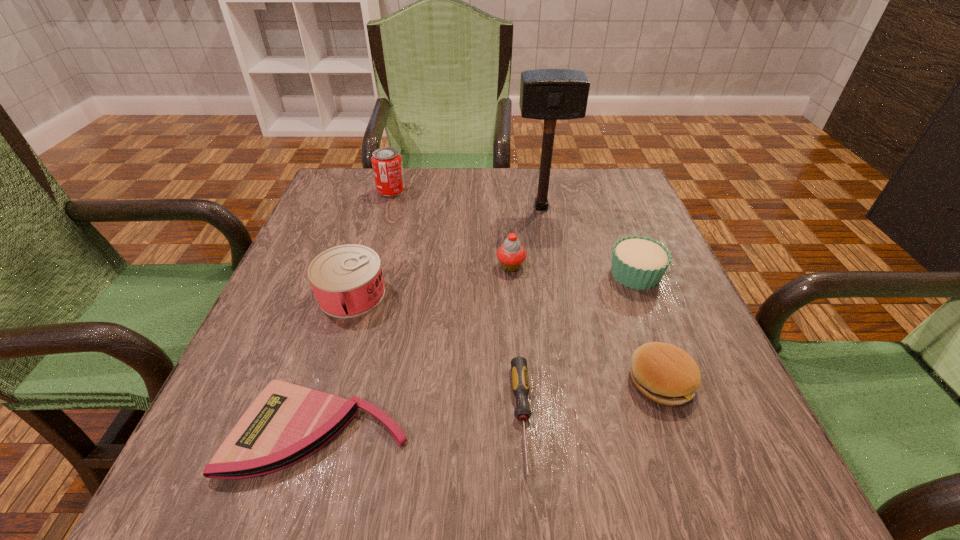
The width and height of the screenshot is (960, 540). What are the coordinates of `free space located on the back of the mallet` in the screenshot? It's located at (536, 179).

Where is `vacant space located 0.220m on the right of the taller can`? vacant space located 0.220m on the right of the taller can is located at coordinates (488, 191).

Where is `free space located 0.180m on the back of the taller cupcake`? This screenshot has width=960, height=540. free space located 0.180m on the back of the taller cupcake is located at coordinates (507, 211).

The width and height of the screenshot is (960, 540). Identify the location of vacant space located on the right of the shorter can. (535, 294).

Find the location of a particular element. vacant area located on the front of the right cupcake is located at coordinates (697, 431).

I want to click on vacant region located 0.140m on the left of the patty, so click(543, 381).

This screenshot has width=960, height=540. What are the coordinates of `free region located on the back of the wristlet` in the screenshot? It's located at 360,291.

You are a GUI agent. You are given a task and a screenshot of the screen. Output one action in this format:
    pyautogui.click(x=<x>, y=<y>)
    Task: Click on the mallet that is at the far edge
    
    Given the screenshot: What is the action you would take?
    pyautogui.click(x=545, y=94)

Where is `can at the far edge`? The image size is (960, 540). can at the far edge is located at coordinates (387, 165).

Find the location of `wristlet at the near edge`. wristlet at the near edge is located at coordinates (286, 423).